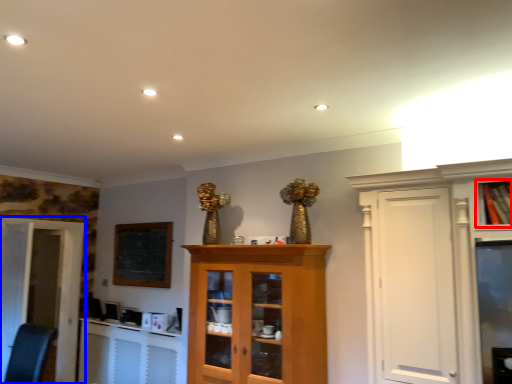
Question: Which point is closer to the camera, cabinetry (highlighted by a red box) or door (highlighted by a blue box)?

Choices:
 (A) cabinetry
 (B) door

Answer: (A)